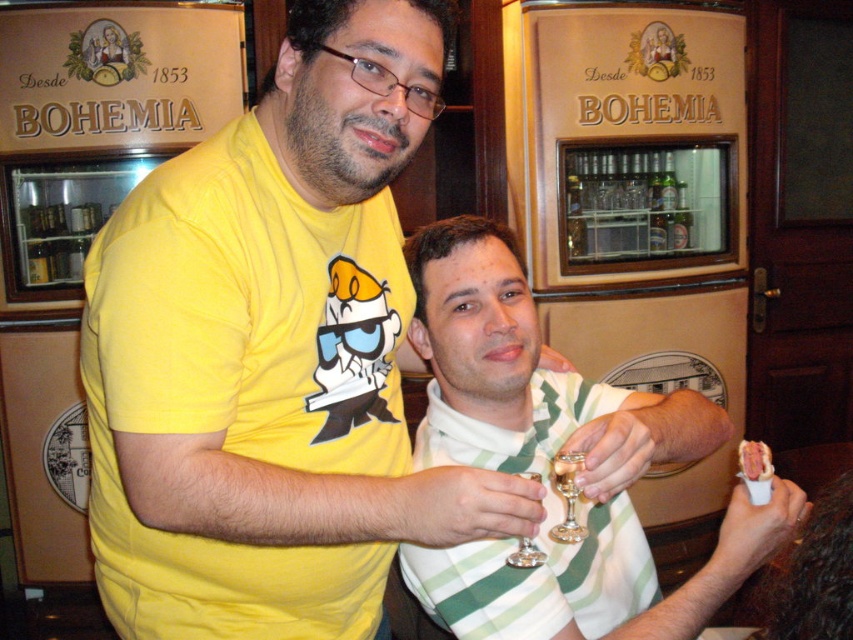
You are a bartender who needs to reach the clear glass bottles at center from the white striped shirt at center. Can you comfortably reach them without moving your feet if your arm length is 2.5 feet?

The distance between the white striped shirt at center and the clear glass bottles at center is 5.78 feet, which is greater than your arm length of 2.5 feet. Therefore, you cannot reach the clear glass bottles at center without moving your feet.

You are a photographer at the bar and want to take a photo of the white striped shirt at center and the green striped shirt at center. Which one should you focus on first to ensure both are in focus?

You should focus on the white striped shirt at center first because it is closer to the viewer than the green striped shirt at center, so adjusting focus from near to far will help both be in focus.

Based on the photo, you are standing in the bar and want to take a photo of the white striped shirt at center. Where should you aim your camera to capture it?

The white striped shirt at center is located at the 2D coordinates point (552,458), so you should aim your camera there to capture it.